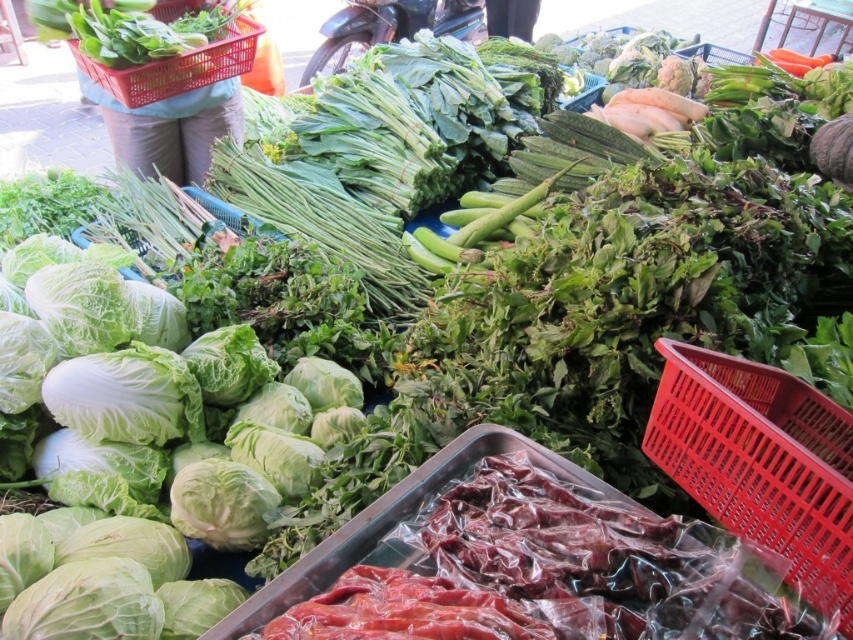
You are a customer at the market and want to choose a taller red plastic basket. Which one should you pick between the red plastic basket at upper right and the red plastic basket at upper left?

The red plastic basket at upper left is taller than the red plastic basket at upper right, so you should choose the red plastic basket at upper left.